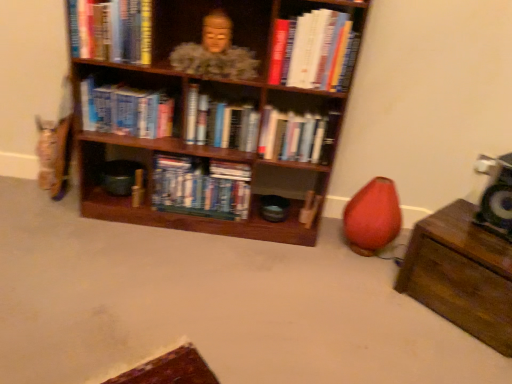
Locate an element on the screen. free space to the left of brown wooden chest at lower right is located at coordinates (372, 298).